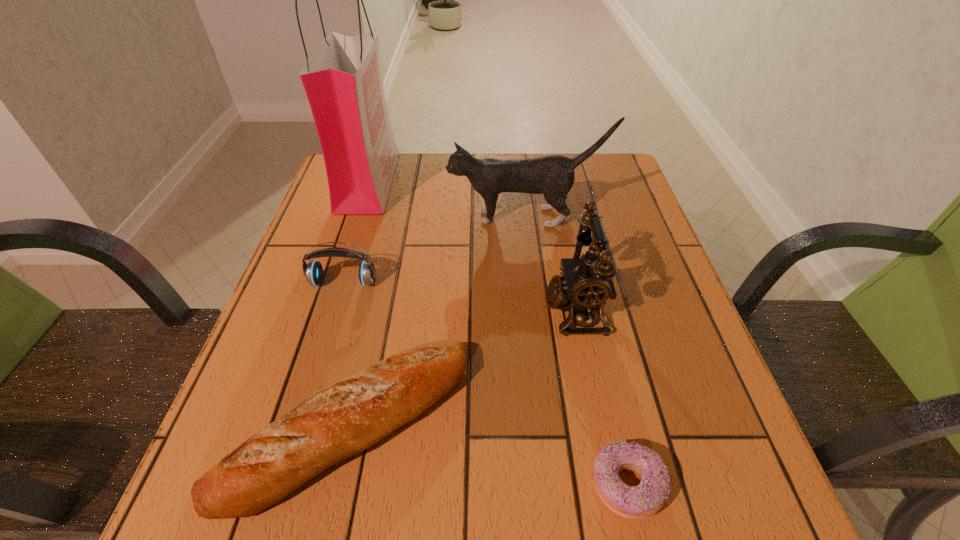
Locate an element on the screen. The image size is (960, 540). shopping bag is located at coordinates (343, 82).

Where is `the second tallest object`? the second tallest object is located at coordinates (553, 176).

The image size is (960, 540). Find the location of `telephone`. telephone is located at coordinates (587, 283).

Identify the location of headset. (313, 271).

Identify the location of baguet. The image size is (960, 540). (341, 420).

You are a GUI agent. You are given a task and a screenshot of the screen. Output one action in this format:
    pyautogui.click(x=<x>, y=<y>)
    Task: Click on the doughnut
    Image resolution: width=960 pixels, height=540 pixels.
    Given the screenshot: What is the action you would take?
    pyautogui.click(x=638, y=502)

You are a GUI agent. You are given a task and a screenshot of the screen. Output one action in this format:
    pyautogui.click(x=<x>, y=<y>)
    Task: Click on the vacant space positioned 0.150m on the front-facing side of the shopping bag
    The height and width of the screenshot is (540, 960).
    Given the screenshot: What is the action you would take?
    pyautogui.click(x=447, y=181)

Identify the location of vacant space located 0.300m at the face of the fifth shortest object. This screenshot has width=960, height=540. (328, 217).

Locate an element on the screen. The width and height of the screenshot is (960, 540). vacant region located 0.070m at the face of the fifth shortest object is located at coordinates (420, 217).

Identify the location of vacant area situated at the face of the fifth shortest object. This screenshot has width=960, height=540. [352, 217].